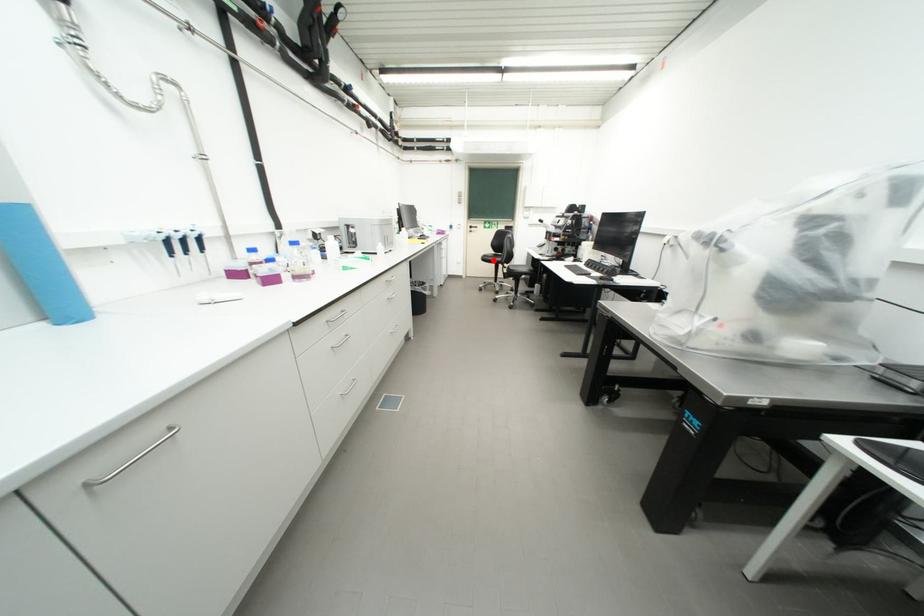
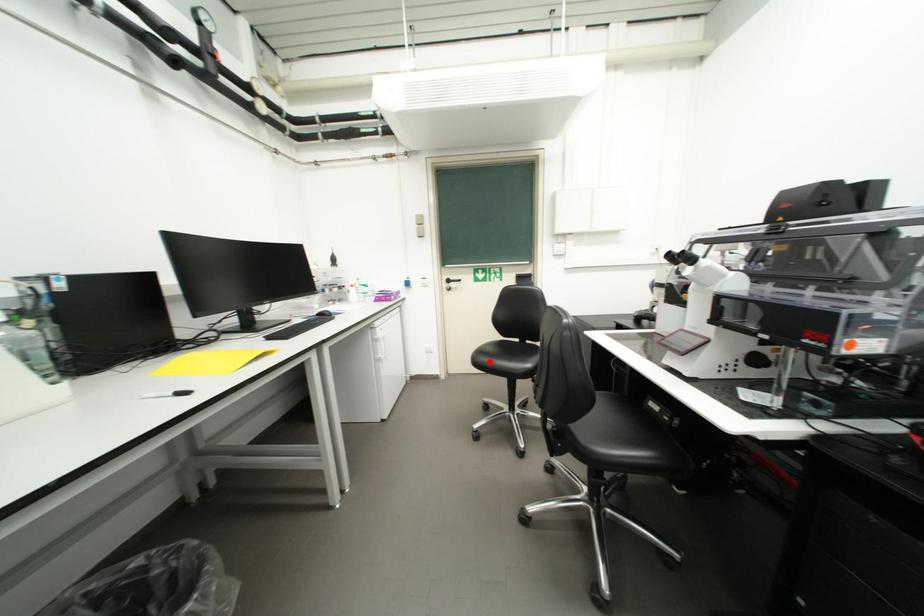
I am providing you with two images of the same scene from different viewpoints. A red point is marked on the first image and another point is marked on the second image. Are the points marked in image1 and image2 representing the same 3D position?

Yes